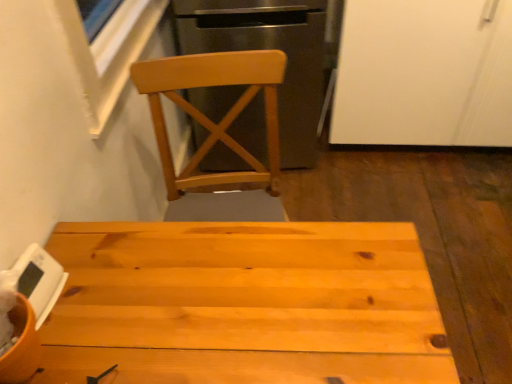
Where is `free spot above natural wood table at center (from a real-world perspective)`? The width and height of the screenshot is (512, 384). free spot above natural wood table at center (from a real-world perspective) is located at coordinates click(x=214, y=285).